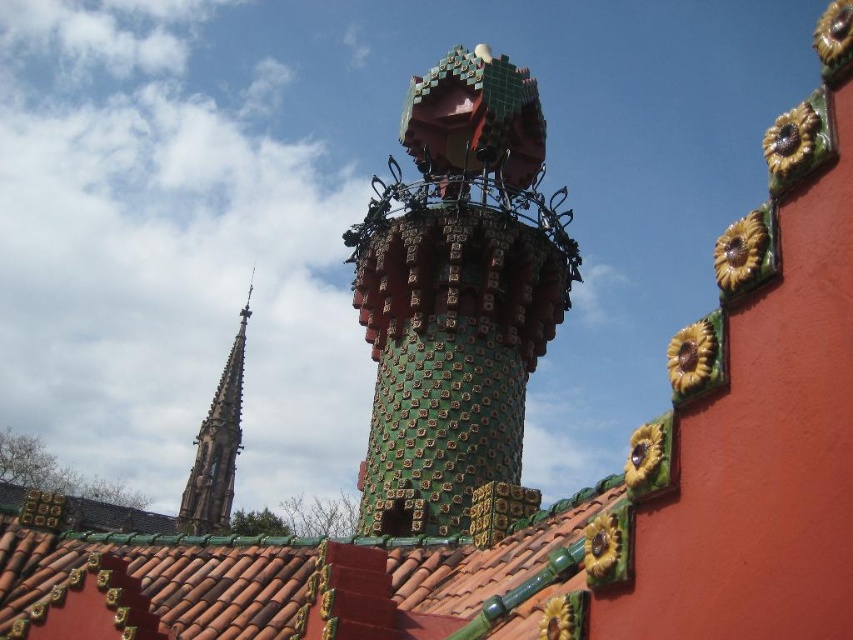
Question: Estimate the real-world distances between objects in this image. Which object is farther from the green mosaic spire at upper left?

Choices:
 (A) green mosaic tower at center
 (B) green glazed tiles at center

Answer: (A)

Question: Estimate the real-world distances between objects in this image. Which object is farther from the green mosaic tower at center?

Choices:
 (A) green mosaic spire at upper left
 (B) green glazed tiles at center

Answer: (A)

Question: Is green mosaic tower at center above green glazed tiles at center?

Choices:
 (A) yes
 (B) no

Answer: (A)

Question: Does green mosaic tower at center appear on the right side of green mosaic spire at upper left?

Choices:
 (A) no
 (B) yes

Answer: (B)

Question: Does green mosaic tower at center appear on the right side of green glazed tiles at center?

Choices:
 (A) no
 (B) yes

Answer: (B)

Question: Among these points, which one is farthest from the camera?

Choices:
 (A) (184, 522)
 (B) (515, 237)
 (C) (317, 566)

Answer: (A)